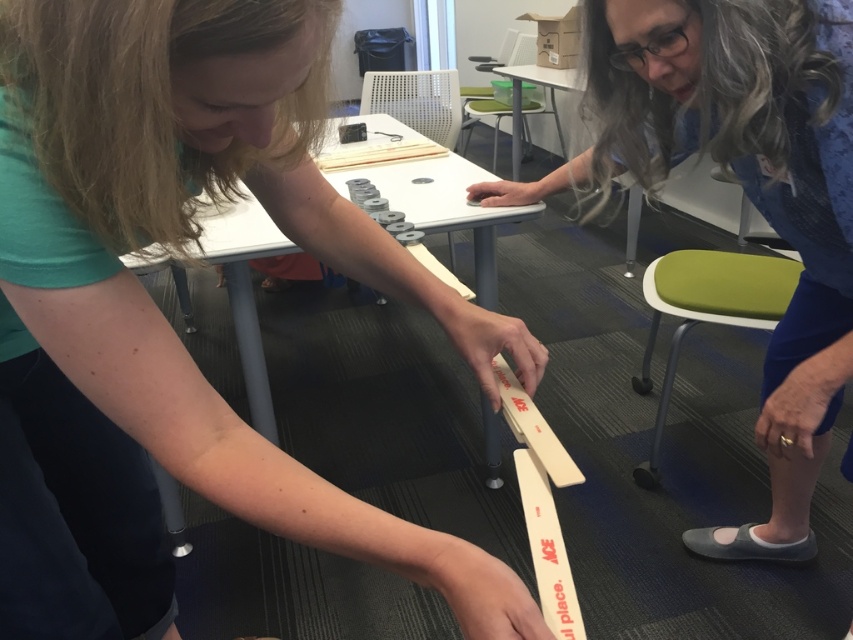
Can you confirm if matte white ruler at lower center is thinner than wooden ruler at center?

Indeed, matte white ruler at lower center has a lesser width compared to wooden ruler at center.

Is matte white ruler at lower center further to the viewer compared to wooden ruler at center?

No, matte white ruler at lower center is in front of wooden ruler at center.

Which is in front, point (328, 502) or point (685, 13)?

Point (328, 502) is more forward.

This screenshot has height=640, width=853. Find the location of `matte white ruler at lower center`. matte white ruler at lower center is located at coordinates (194, 234).